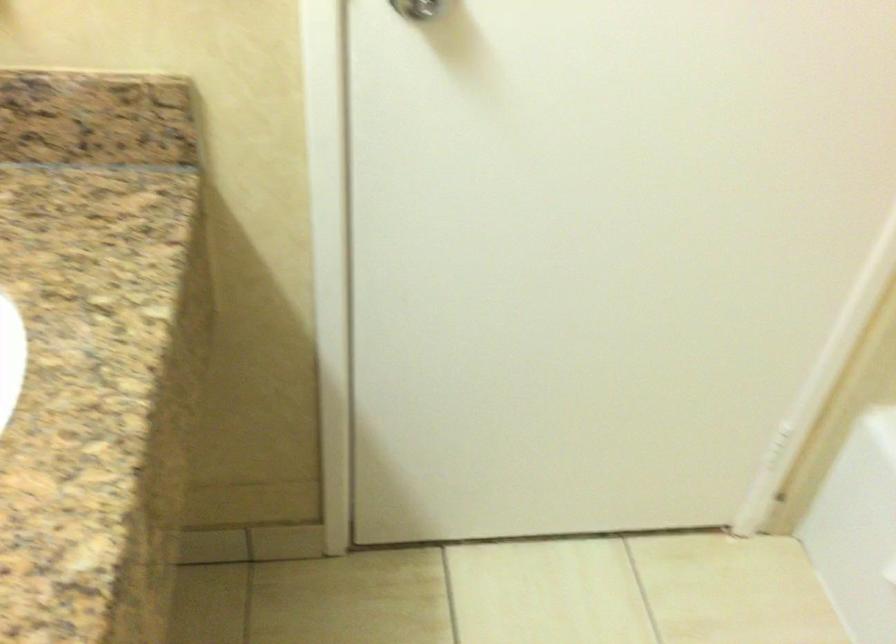
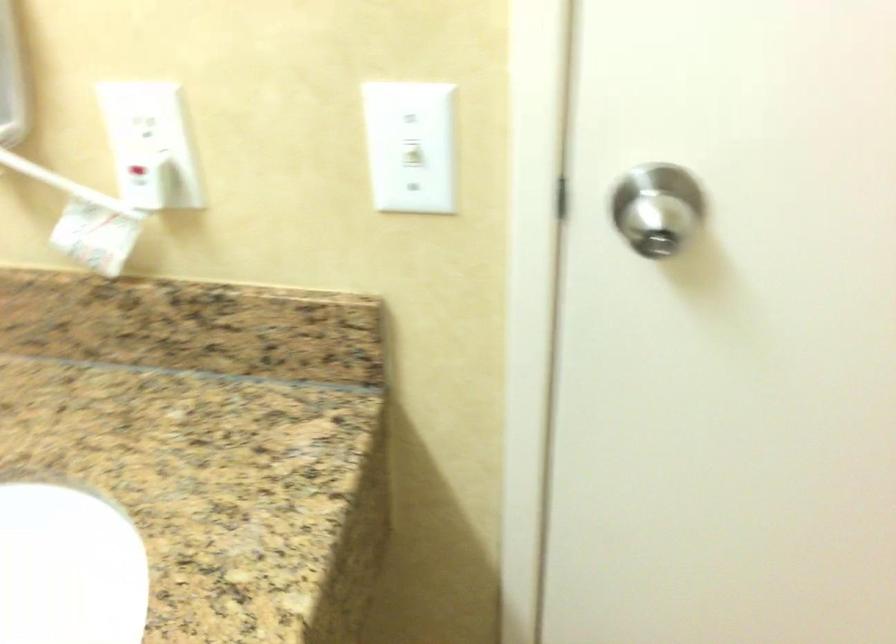
Question: The camera is either moving clockwise (left) or counter-clockwise (right) around the object. The first image is from the beginning of the video and the second image is from the end. Is the camera moving left or right when shooting the video?

Choices:
 (A) Left
 (B) Right

Answer: (B)